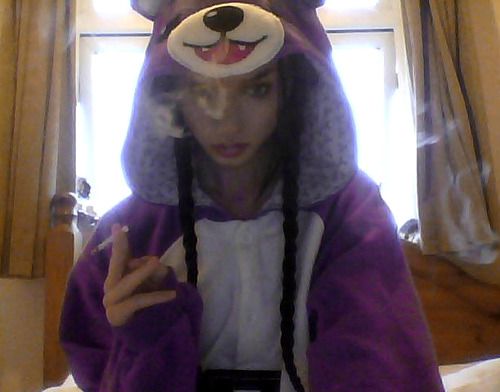
Locate an element on the screen. window is located at coordinates (113, 96).